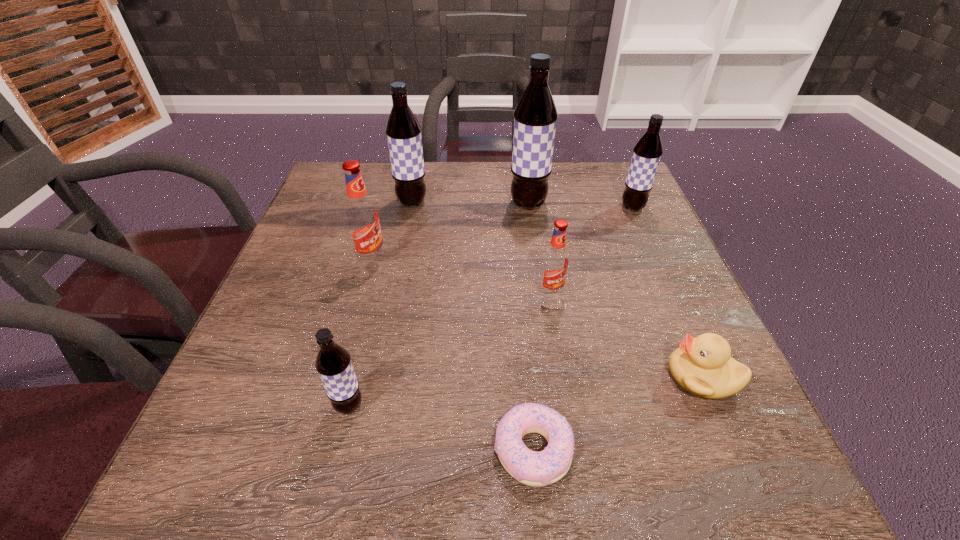
Locate an element on the screen. the nearest brown root beer is located at coordinates (333, 363).

You are a GUI agent. You are given a task and a screenshot of the screen. Output one action in this format:
    pyautogui.click(x=<x>, y=<y>)
    Task: Click on the smallest brown root beer
    Image resolution: width=960 pixels, height=540 pixels.
    Given the screenshot: What is the action you would take?
    pyautogui.click(x=333, y=363)

The width and height of the screenshot is (960, 540). What are the coordinates of `the seventh tallest object` in the screenshot? It's located at (703, 365).

You are a GUI agent. You are given a task and a screenshot of the screen. Output one action in this format:
    pyautogui.click(x=<x>, y=<y>)
    Task: Click on the duckling
    The image size is (960, 540).
    Given the screenshot: What is the action you would take?
    pyautogui.click(x=703, y=365)

This screenshot has width=960, height=540. In order to click on the shortest object in this screenshot , I will do `click(546, 467)`.

In order to click on pink doughnut in this screenshot , I will do `click(546, 467)`.

Identify the location of free space located on the back of the tallest root beer. (522, 164).

Locate an element on the screen. The width and height of the screenshot is (960, 540). free space located on the front of the second biggest brown root beer is located at coordinates click(x=395, y=288).

This screenshot has width=960, height=540. I want to click on vacant area located on the left of the rightmost root beer, so click(x=569, y=207).

Find the location of a particular element. free space located 0.160m on the right of the fifth nearest object is located at coordinates (458, 260).